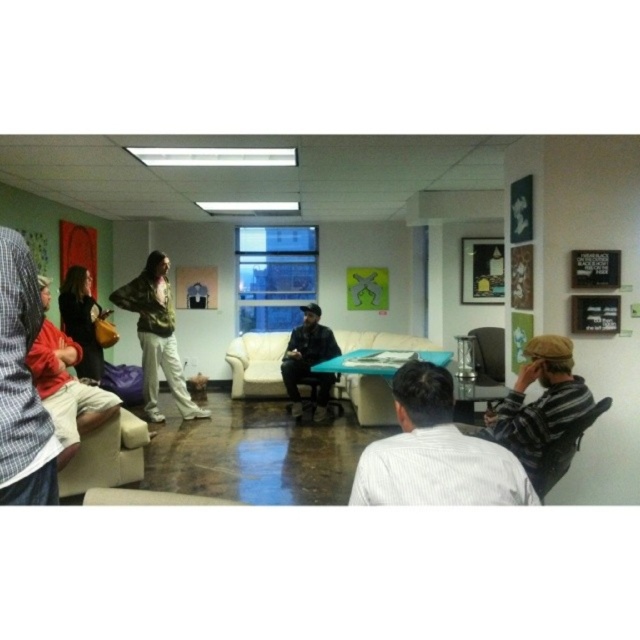
You are planning to rearrange the furniture in the room. If you want to move the white leather couch at center closer to the matte brown jacket at left, will there be enough space between them after moving?

The white leather couch at center occupies less space than matte brown jacket at left. Moving the white leather couch at center closer to the matte brown jacket at left would still leave enough space between them since the couch takes up less area.

You are a guest at this event and want to sit next to the matte brown jacket at left. Where should you sit relative to the white leather couch at center?

The white leather couch at center is on the left side of the matte brown jacket at left, so to sit next to the matte brown jacket at left, you should sit on the right side of the white leather couch at center.